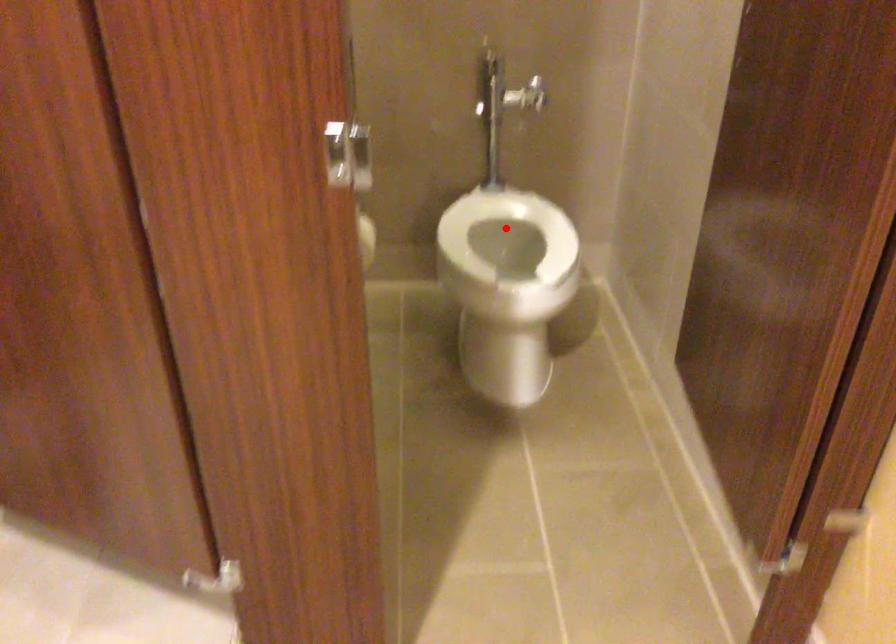
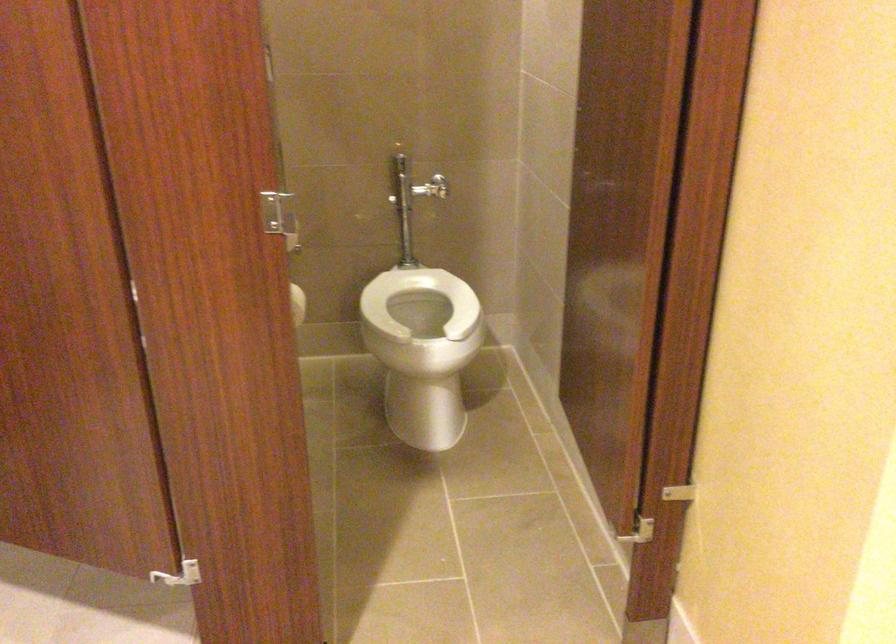
Question: A red point is marked in image1. In image2, is the corresponding 3D point closer to the camera or farther? Reply with the corresponding letter.

Choices:
 (A) The corresponding 3D point is closer.
 (B) The corresponding 3D point is farther.

Answer: (B)